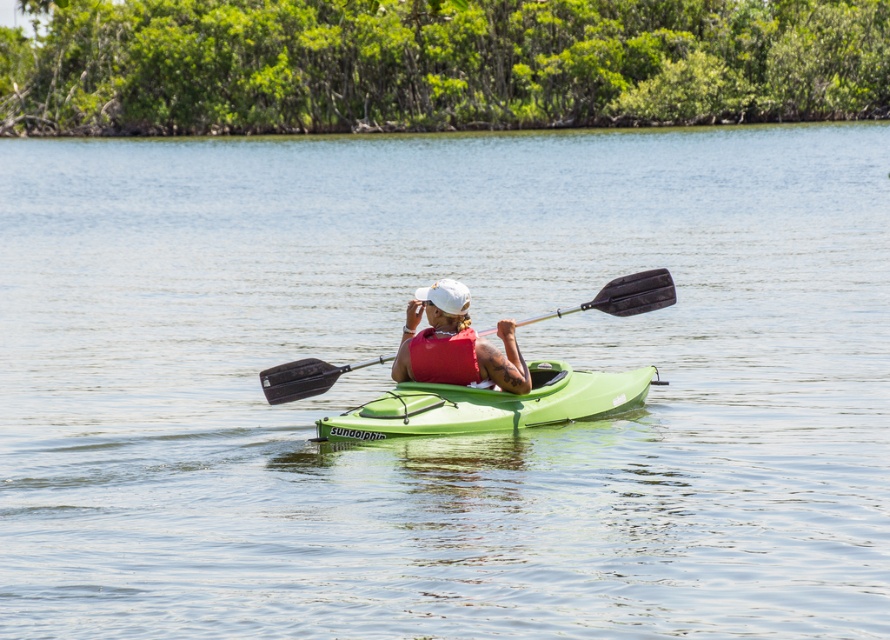
Based on the photo, you are a photographer trying to capture the kayaker from the shore. You notice the white matte life vest at center and the black rubber paddle at center. Which object should you focus on first if you want to photograph the one closer to the left side of the kayak?

The white matte life vest at center is to the left of the black rubber paddle at center, so you should focus on the white matte life vest at center first as it is positioned closer to the left side of the kayak.

You are planning to store both the green matte kayak at center and the white matte life vest at center in a storage compartment. The compartment has a width of 1.2 meters. Can you fit both items side by side without overlapping?

The green matte kayak at center might be wider than white matte life vest at center. If the kayak is wider than 1.2 meters, they won t fit. If it s narrower, they might fit. Check the actual width of the kayak to be sure.

You are a safety inspector checking the kayaker setup. The green matte kayak at center and white matte life vest at center must be positioned correctly for safety. According to the safety manual, the life vest should be worn above the kayak. Is the current arrangement compliant with safety standards?

The green matte kayak at center is located below the white matte life vest at center, which means the life vest is positioned above the kayak. This arrangement complies with the safety standards requiring the life vest to be worn above the kayak.